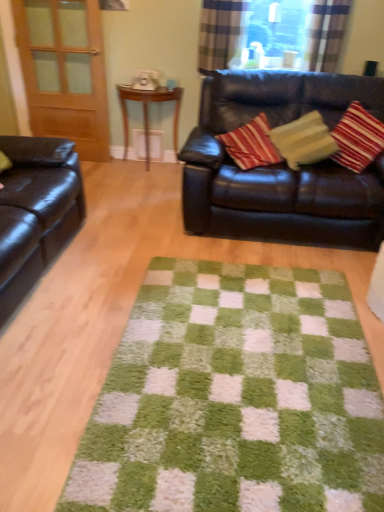
At what (x,y) coordinates should I click in order to perform the action: click on free location to the right of shiny brown leather couch at left, acting as the second studio couch starting from the right. Please return your answer as a coordinate pair (x, y). This screenshot has width=384, height=512. Looking at the image, I should click on 117,263.